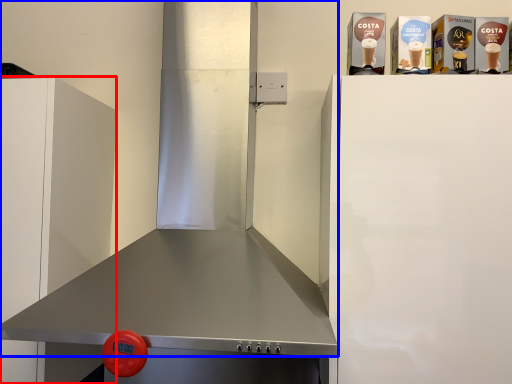
Question: Which object appears farthest to the camera in this image, cabinetry (highlighted by a red box) or exhaust hood (highlighted by a blue box)?

Choices:
 (A) cabinetry
 (B) exhaust hood

Answer: (A)